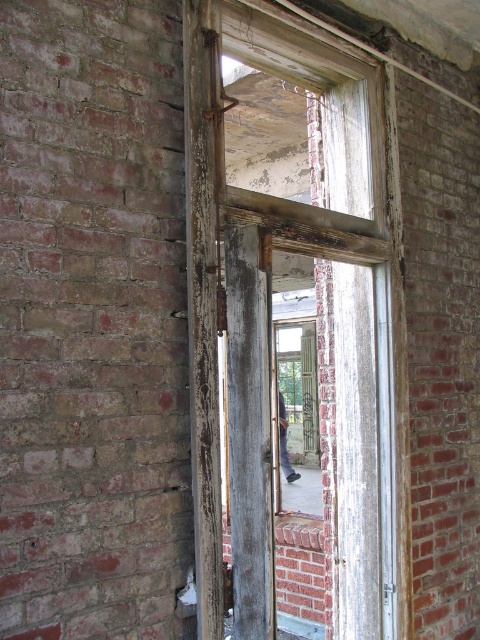
Question: Among these points, which one is nearest to the camera?

Choices:
 (A) (280, 419)
 (B) (238, 208)

Answer: (B)

Question: Does weathered wood window frame at center lie in front of dark gray fabric pants at center?

Choices:
 (A) yes
 (B) no

Answer: (A)

Question: Which of the following is the farthest from the observer?

Choices:
 (A) weathered wood window frame at center
 (B) dark gray fabric pants at center

Answer: (B)

Question: Does weathered wood window frame at center lie behind dark gray fabric pants at center?

Choices:
 (A) yes
 (B) no

Answer: (B)

Question: Is weathered wood window frame at center smaller than dark gray fabric pants at center?

Choices:
 (A) yes
 (B) no

Answer: (B)